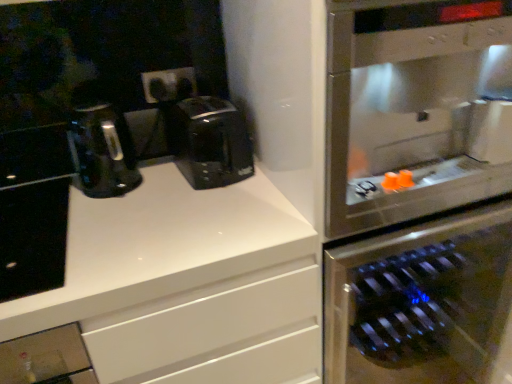
Where is `stainless steel oven at right`? This screenshot has height=384, width=512. stainless steel oven at right is located at coordinates (420, 302).

Describe the element at coordinates (209, 142) in the screenshot. The image size is (512, 384). I see `black plastic coffee maker at center` at that location.

This screenshot has width=512, height=384. What do you see at coordinates (415, 109) in the screenshot?
I see `stainless steel wine cooler at right` at bounding box center [415, 109].

Identify the location of black matte cabinet at left. Image resolution: width=512 pixels, height=384 pixels. (33, 238).

At what (x,y) coordinates should I click in order to perform the action: click on white glossy countertop at upper left. Please return your answer as a coordinate pair (x, y). Image resolution: width=512 pixels, height=384 pixels. Looking at the image, I should click on (161, 246).

You are a GUI agent. You are given a task and a screenshot of the screen. Output one action in this format:
    pyautogui.click(x=<x>, y=<y>)
    Task: Click on the counter top in front of the black matte cabinet at left
    
    Given the screenshot: What is the action you would take?
    pyautogui.click(x=161, y=246)

Considering the sizes of objects white glossy countertop at upper left and black matte cabinet at left in the image provided, who is smaller, white glossy countertop at upper left or black matte cabinet at left?

Smaller between the two is black matte cabinet at left.

Is black plastic coffee maker at center oriented towards stainless steel oven at right?

No, black plastic coffee maker at center is not aimed at stainless steel oven at right.

From a real-world perspective, is black plastic coffee maker at center below stainless steel oven at right?

Incorrect, from a real-world perspective, black plastic coffee maker at center is higher than stainless steel oven at right.

Find the location of a particular element. This screenshot has width=512, height=384. oven on the right of the black plastic coffee maker at center is located at coordinates (420, 302).

Based on the photo, is black plastic coffee maker at center bigger or smaller than stainless steel oven at right?

black plastic coffee maker at center is smaller than stainless steel oven at right.

Which is further, (183, 93) or (93, 273)?

The point (183, 93) is farther from the camera.

Can you confirm if black plastic outlets at center is taller than white glossy countertop at upper left?

In fact, black plastic outlets at center may be shorter than white glossy countertop at upper left.

Locate an element on the screen. This screenshot has width=512, height=384. electric outlet above the white glossy countertop at upper left (from the image's perspective) is located at coordinates (169, 85).

Is black plastic outlets at center oriented away from white glossy countertop at upper left?

black plastic outlets at center does not have its back to white glossy countertop at upper left.

Which object is further away from the camera, stainless steel wine cooler at right or black plastic outlets at center?

black plastic outlets at center is more distant.

Considering the positions of point (401, 245) and point (181, 95), is point (401, 245) closer or farther from the camera than point (181, 95)?

Point (401, 245) appears to be closer to the viewer than point (181, 95).

Can you confirm if stainless steel wine cooler at right is wider than black plastic outlets at center?

Correct, the width of stainless steel wine cooler at right exceeds that of black plastic outlets at center.

Considering the sizes of objects stainless steel wine cooler at right and black plastic outlets at center in the image provided, who is bigger, stainless steel wine cooler at right or black plastic outlets at center?

stainless steel wine cooler at right.

Between black matte cabinet at left and white glossy countertop at upper left, which one is positioned behind?

black matte cabinet at left is further away from the camera.

Considering the positions of objects black matte cabinet at left and white glossy countertop at upper left in the image provided, who is more to the right, black matte cabinet at left or white glossy countertop at upper left?

white glossy countertop at upper left is more to the right.

Is black matte cabinet at left completely or partially outside of white glossy countertop at upper left?

Actually, black matte cabinet at left is at least partially inside white glossy countertop at upper left.

Considering the sizes of objects black matte cabinet at left and white glossy countertop at upper left in the image provided, who is wider, black matte cabinet at left or white glossy countertop at upper left?

Wider between the two is white glossy countertop at upper left.

Can you tell me how much stainless steel wine cooler at right and black plastic coffee maker at center differ in facing direction?

stainless steel wine cooler at right and black plastic coffee maker at center are facing 0.0033 degrees away from each other.

Considering the relative sizes of stainless steel wine cooler at right and black plastic coffee maker at center in the image provided, is stainless steel wine cooler at right bigger than black plastic coffee maker at center?

Correct, stainless steel wine cooler at right is larger in size than black plastic coffee maker at center.

Is stainless steel wine cooler at right positioned beyond the bounds of black plastic coffee maker at center?

stainless steel wine cooler at right lies outside black plastic coffee maker at center's area.

Between stainless steel wine cooler at right and black plastic coffee maker at center, which one has less height?

With less height is black plastic coffee maker at center.

Is black plastic coffee maker at center aimed at black matte cabinet at left?

No, black plastic coffee maker at center is not oriented towards black matte cabinet at left.

From the image's perspective, is black plastic coffee maker at center below black matte cabinet at left?

→ No, from the image's perspective, black plastic coffee maker at center is not below black matte cabinet at left.

Is black plastic coffee maker at center surrounding black matte cabinet at left?

No, black plastic coffee maker at center does not contain black matte cabinet at left.

This screenshot has height=384, width=512. Identify the location of cabinetry above the white glossy countertop at upper left (from the image's perspective). (33, 238).

Locate an element on the screen. This screenshot has height=384, width=512. coffee maker located on the left of stainless steel oven at right is located at coordinates (209, 142).

Based on their spatial positions, is stainless steel wine cooler at right or black plastic outlets at center closer to stainless steel oven at right?

The object closer to stainless steel oven at right is stainless steel wine cooler at right.

When comparing their distances from stainless steel oven at right, does white glossy countertop at upper left or black plastic outlets at center seem further?

black plastic outlets at center lies further to stainless steel oven at right than the other object.

Which object lies further to the anchor point stainless steel oven at right, white glossy countertop at upper left or black matte cabinet at left?

black matte cabinet at left is further to stainless steel oven at right.

Considering their positions, is stainless steel oven at right positioned further to white glossy countertop at upper left than black plastic outlets at center?

stainless steel oven at right lies further to white glossy countertop at upper left than the other object.

Considering their positions, is stainless steel wine cooler at right positioned further to black matte cabinet at left than black plastic coffee maker at center?

The object further to black matte cabinet at left is stainless steel wine cooler at right.

Looking at the image, which one is located further to black matte cabinet at left, black plastic coffee maker at center or white glossy countertop at upper left?

Among the two, black plastic coffee maker at center is located further to black matte cabinet at left.

Considering their positions, is white glossy countertop at upper left positioned closer to stainless steel wine cooler at right than black matte cabinet at left?

white glossy countertop at upper left is positioned closer to the anchor stainless steel wine cooler at right.

Considering their positions, is black matte cabinet at left positioned further to stainless steel wine cooler at right than black plastic coffee maker at center?

black matte cabinet at left is positioned further to the anchor stainless steel wine cooler at right.

The image size is (512, 384). I want to click on coffee maker situated between white glossy countertop at upper left and stainless steel wine cooler at right from left to right, so click(x=209, y=142).

I want to click on electric outlet between black matte cabinet at left and stainless steel oven at right from left to right, so click(169, 85).

Find the location of `coffee maker located between black matte cabinet at left and stainless steel oven at right in the left-right direction`. coffee maker located between black matte cabinet at left and stainless steel oven at right in the left-right direction is located at coordinates (209, 142).

Image resolution: width=512 pixels, height=384 pixels. I want to click on home appliance between black plastic coffee maker at center and stainless steel oven at right in the horizontal direction, so click(x=415, y=109).